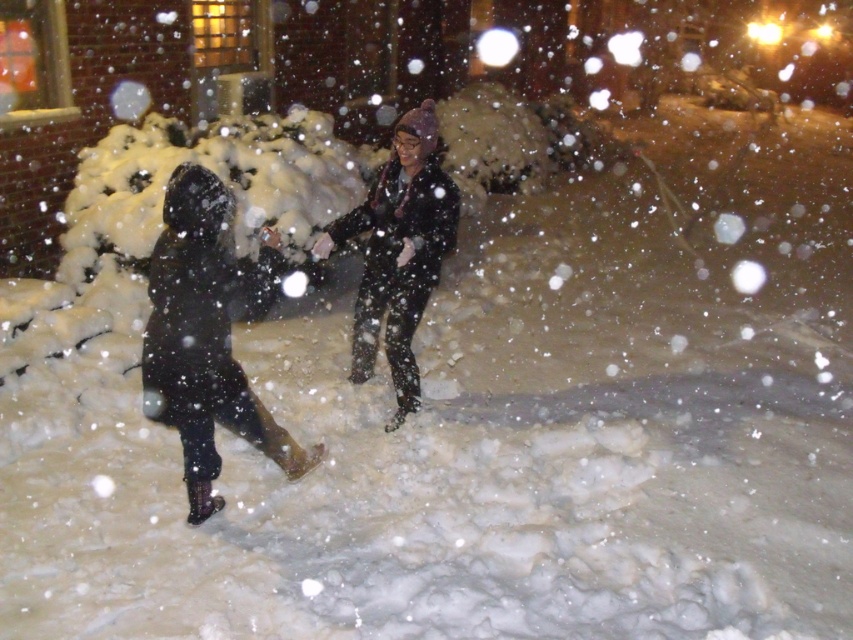
Between black matte coat at left and matte black jacket at center, which one appears on the right side from the viewer's perspective?

matte black jacket at center is more to the right.

What do you see at coordinates (207, 336) in the screenshot? I see `black matte coat at left` at bounding box center [207, 336].

Where is `black matte coat at left`? The width and height of the screenshot is (853, 640). black matte coat at left is located at coordinates (207, 336).